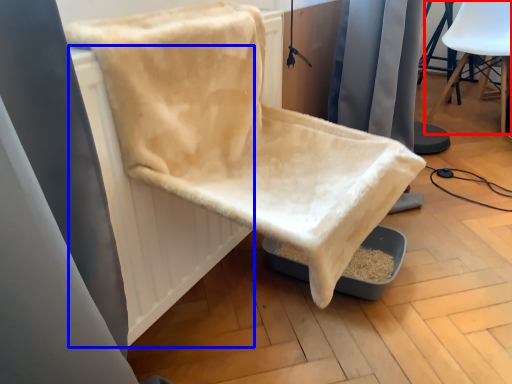
Question: Among these objects, which one is nearest to the camera, chair (highlighted by a red box) or radiator (highlighted by a blue box)?

Choices:
 (A) chair
 (B) radiator

Answer: (B)